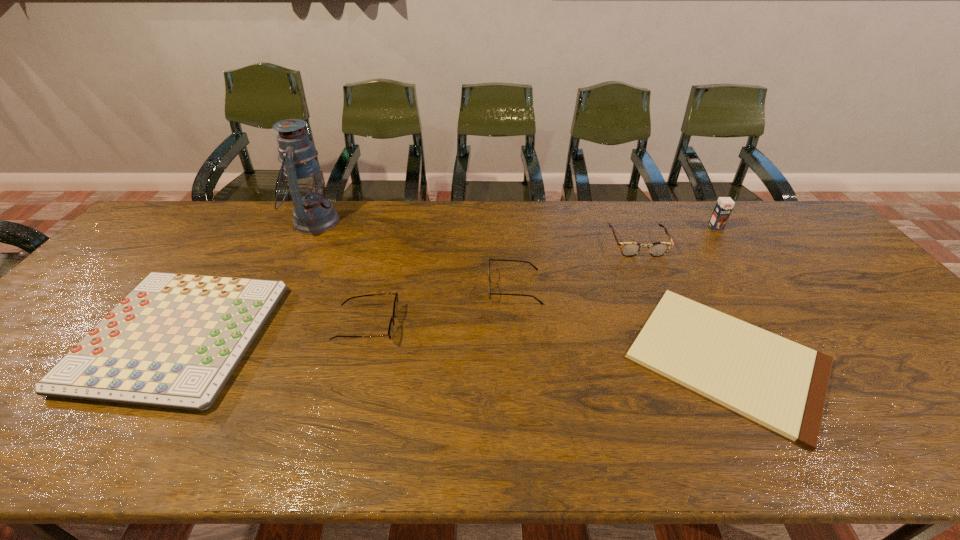
Where is `vacant space located on the front label of the sixth shortest object`? Image resolution: width=960 pixels, height=540 pixels. vacant space located on the front label of the sixth shortest object is located at coordinates (744, 267).

This screenshot has height=540, width=960. I want to click on vacant space located on the frame of the rightmost spectacles, so click(x=683, y=346).

Identify the location of free region located on the front-facing side of the second farthest spectacles. (453, 287).

The width and height of the screenshot is (960, 540). What are the coordinates of `vacant point located on the front-facing side of the second farthest spectacles` in the screenshot? It's located at (446, 287).

You are a GUI agent. You are given a task and a screenshot of the screen. Output one action in this format:
    pyautogui.click(x=<x>, y=<y>)
    Task: Click on the vacant area situated on the front-facing side of the second farthest spectacles
    The height and width of the screenshot is (540, 960).
    Given the screenshot: What is the action you would take?
    pyautogui.click(x=386, y=287)

The image size is (960, 540). What are the coordinates of `free spot located 0.070m on the face of the leftmost spectacles` in the screenshot? It's located at (423, 326).

In order to click on vacant space located 0.090m on the front of the gameboard in this screenshot , I will do 99,456.

At what (x,y) coordinates should I click in order to perform the action: click on vacant area situated on the right of the clipboard. Please return your answer as a coordinate pair (x, y). The width and height of the screenshot is (960, 540). Looking at the image, I should click on (905, 359).

The width and height of the screenshot is (960, 540). In order to click on lantern present at the far edge in this screenshot , I will do `click(312, 215)`.

Find the location of a particular element. The image size is (960, 540). chocolate milk that is at the far edge is located at coordinates click(724, 205).